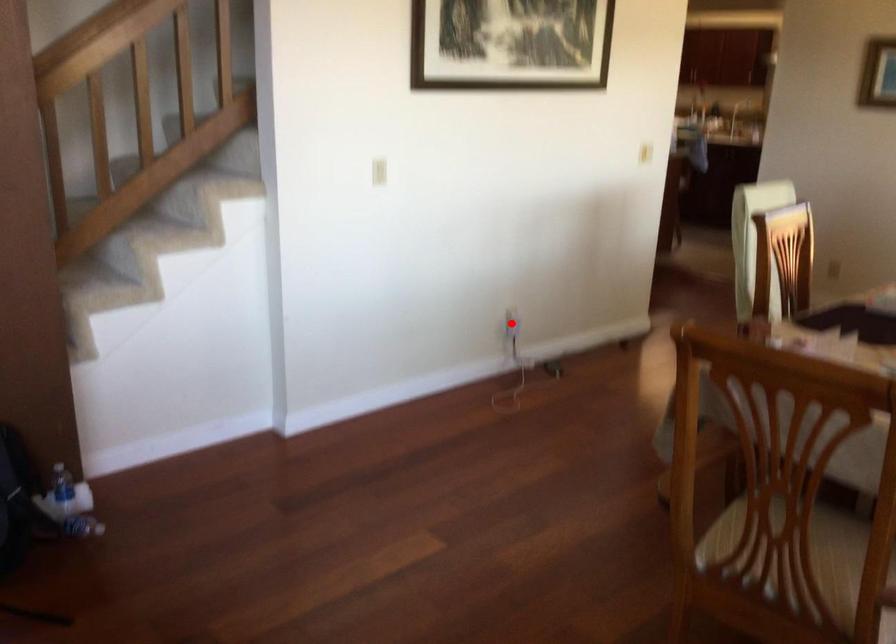
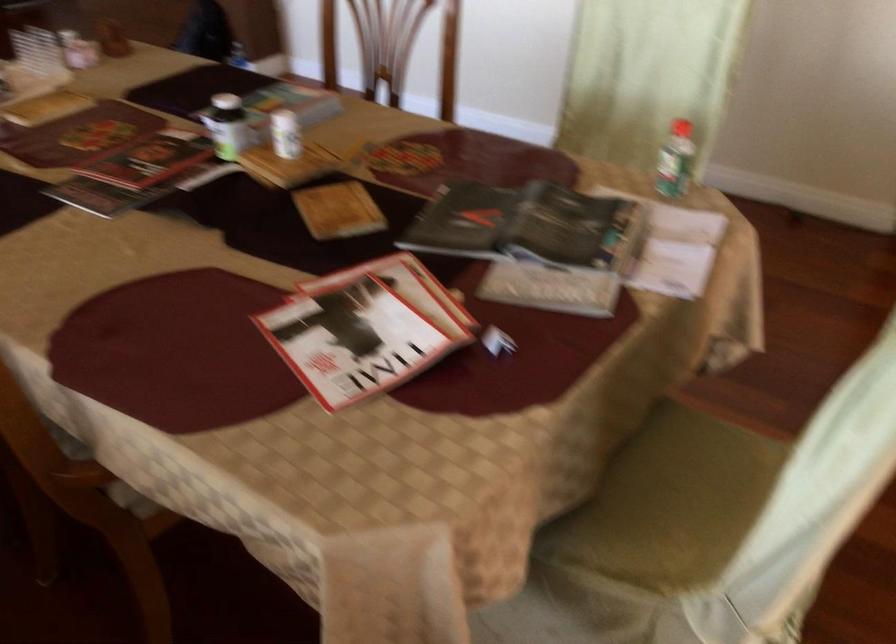
Question: I am providing you with two images of the same scene from different viewpoints. A red point is marked on the first image. Is the red point's position out of view in image 2?

Choices:
 (A) Yes
 (B) No

Answer: (A)